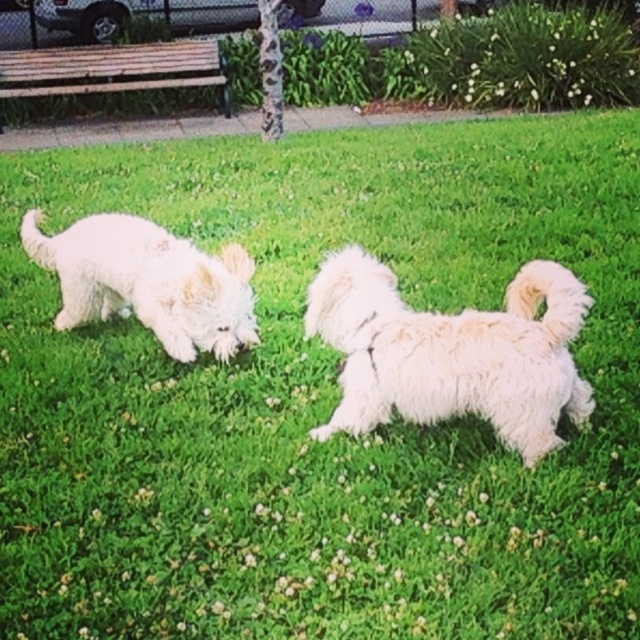
Question: Is white fluffy dog at center bigger than white fluffy dog at left?

Choices:
 (A) no
 (B) yes

Answer: (B)

Question: Is white fluffy dog at center below white fluffy dog at left?

Choices:
 (A) no
 (B) yes

Answer: (B)

Question: Which point is farther from the camera taking this photo?

Choices:
 (A) (152, 324)
 (B) (456, 387)

Answer: (A)

Question: Does white fluffy dog at center lie in front of white fluffy dog at left?

Choices:
 (A) no
 (B) yes

Answer: (B)